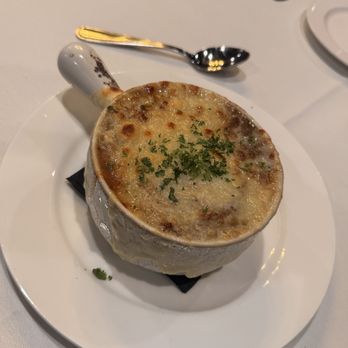
Find the location of `flat plate`. flat plate is located at coordinates (328, 25), (48, 242).